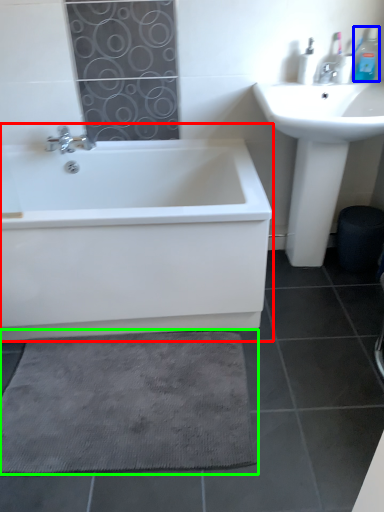
Question: Which object is the closest to the bathtub (highlighted by a red box)? Choose among these: toiletry (highlighted by a blue box) or bath mat (highlighted by a green box).

Choices:
 (A) toiletry
 (B) bath mat

Answer: (B)